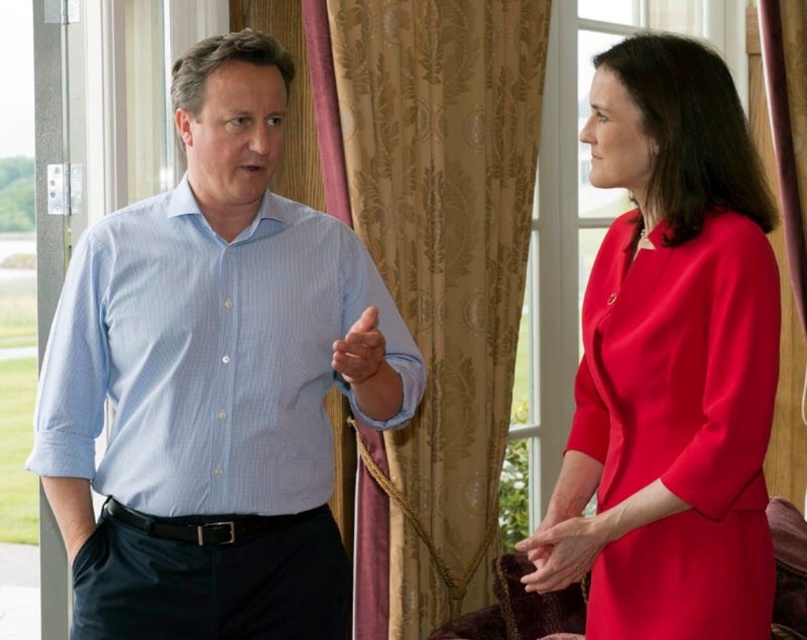
Question: Which of the following is the farthest from the observer?

Choices:
 (A) (366, 324)
 (B) (486, 202)

Answer: (B)

Question: Based on their relative distances, which object is farther from the matte blue shirt at center?

Choices:
 (A) gold textured curtain at center
 (B) light blue striped shirt at left

Answer: (A)

Question: Which of the following is the closest to the observer?

Choices:
 (A) smooth red dress at center
 (B) matte blue shirt at center
 (C) gold textured curtain at center
 (D) light blue striped shirt at left

Answer: (B)

Question: Observing the image, what is the correct spatial positioning of gold textured curtain at center in reference to matte red dress at right?

Choices:
 (A) right
 (B) left

Answer: (B)

Question: Is light blue striped shirt at left to the left of matte red dress at right from the viewer's perspective?

Choices:
 (A) yes
 (B) no

Answer: (A)

Question: Is smooth red dress at center positioned behind matte blue shirt at center?

Choices:
 (A) yes
 (B) no

Answer: (A)